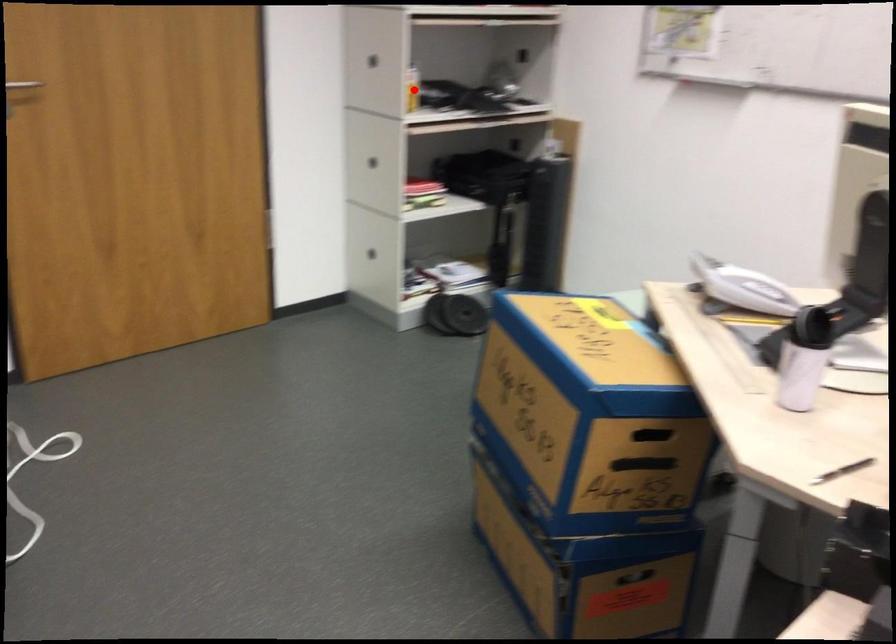
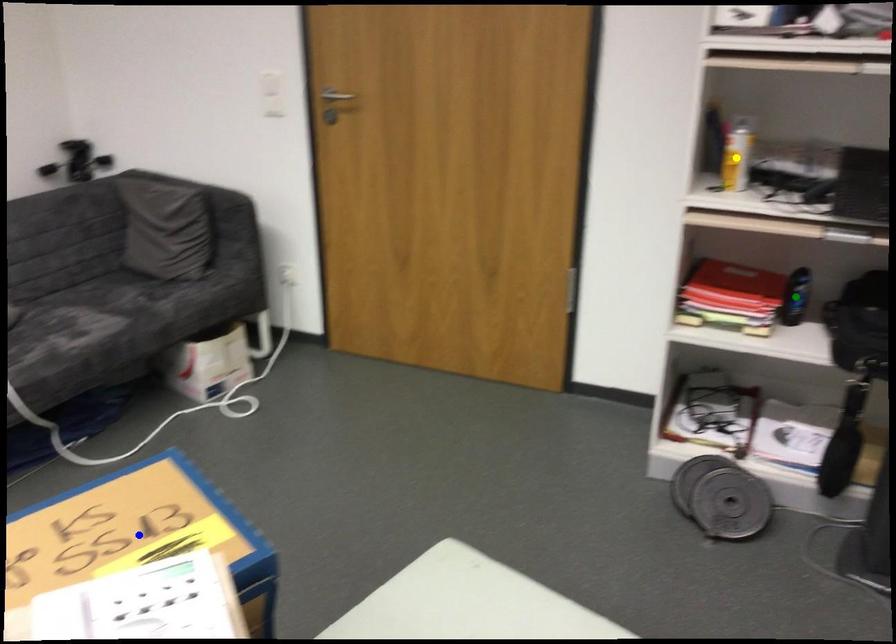
Question: I am providing you with two images of the same scene from different viewpoints. A red point is marked on the first image. You are given multiple points on the second image. Which point in image 2 is actually the same real-world point as the red point in image 1?

Choices:
 (A) green point
 (B) blue point
 (C) yellow point

Answer: (C)